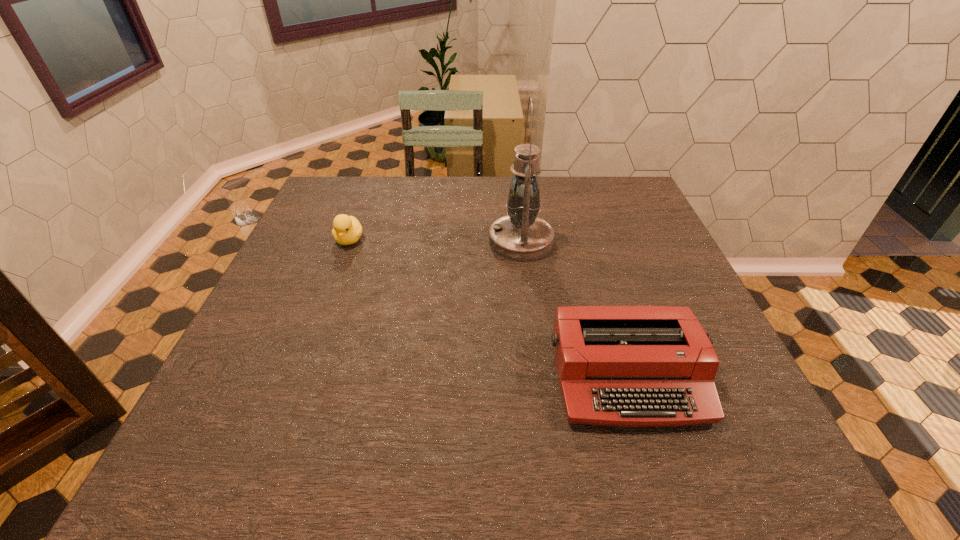
Locate an element on the screen. Image resolution: width=960 pixels, height=540 pixels. the tallest object is located at coordinates (521, 236).

This screenshot has height=540, width=960. I want to click on typewriter, so click(x=633, y=366).

Locate an element on the screen. Image resolution: width=960 pixels, height=540 pixels. the leftmost object is located at coordinates (347, 230).

Locate an element on the screen. The image size is (960, 540). vacant space located 0.120m on the right of the oil lamp is located at coordinates (597, 241).

Locate an element on the screen. This screenshot has width=960, height=540. vacant region located 0.290m on the front-facing side of the duck is located at coordinates (314, 334).

Locate an element on the screen. The image size is (960, 540). object located in the left edge section of the desktop is located at coordinates (347, 230).

This screenshot has width=960, height=540. In order to click on object located at the right edge in this screenshot , I will do `click(633, 366)`.

The width and height of the screenshot is (960, 540). In the image, there is a desktop. Find the location of `vacant space at the far edge`. vacant space at the far edge is located at coordinates (545, 182).

Locate an element on the screen. Image resolution: width=960 pixels, height=540 pixels. vacant space at the near edge is located at coordinates (432, 436).

Find the location of a particular element. The width and height of the screenshot is (960, 540). free spot at the left edge of the desktop is located at coordinates [x=294, y=295].